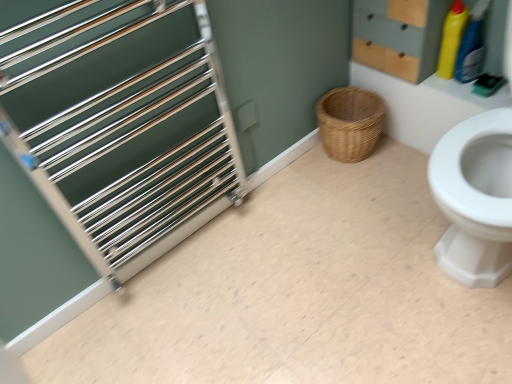
Identify the location of vacant space underneath polished metal rack at left (from a real-world perspective). This screenshot has height=384, width=512. (187, 250).